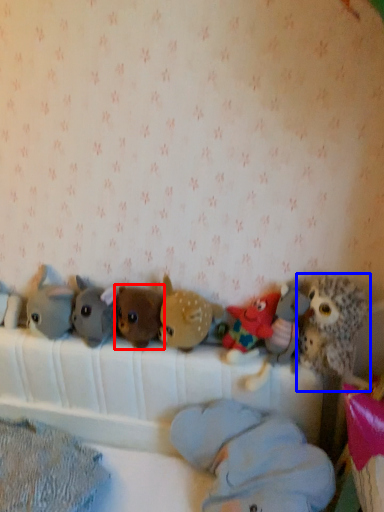
Question: Which point is closer to the camera, toy (highlighted by a red box) or toy (highlighted by a blue box)?

Choices:
 (A) toy
 (B) toy

Answer: (B)